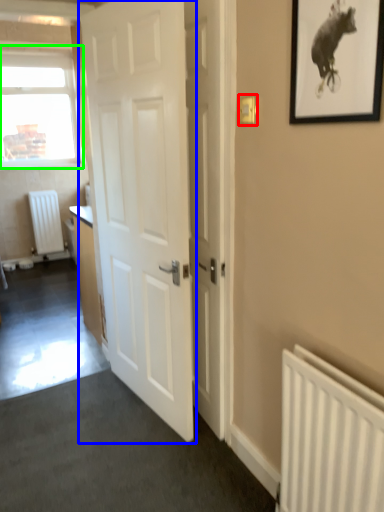
Question: Estimate the real-world distances between objects in this image. Which object is closer to light switch (highlighted by a red box), door (highlighted by a blue box) or window (highlighted by a green box)?

Choices:
 (A) door
 (B) window

Answer: (A)